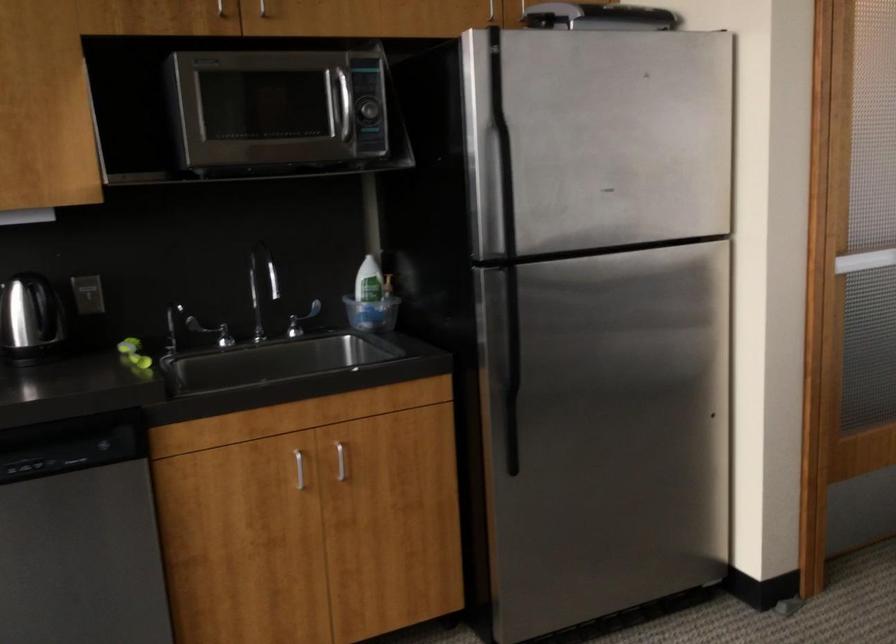
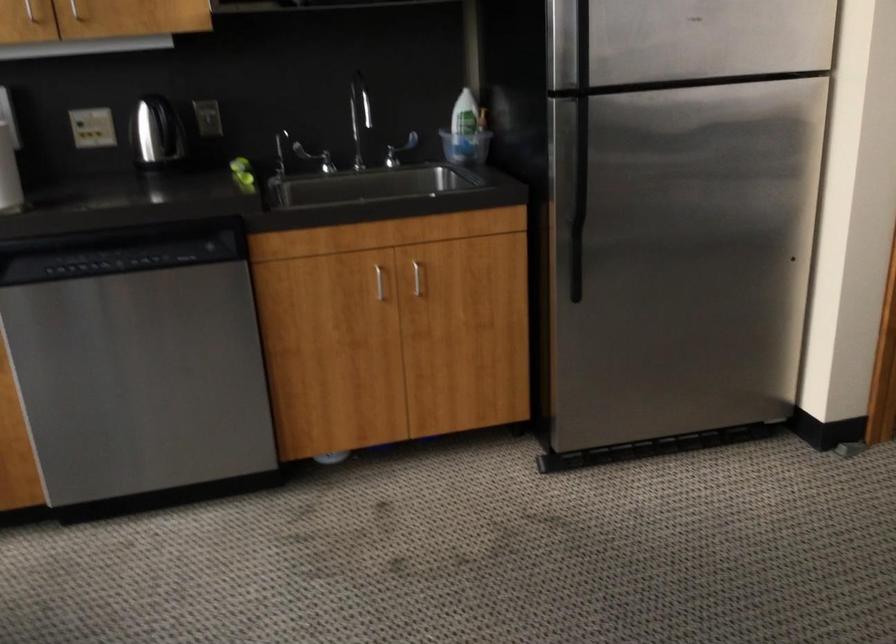
Question: How did the camera likely rotate?

Choices:
 (A) Left
 (B) Right
 (C) Up
 (D) Down

Answer: (A)